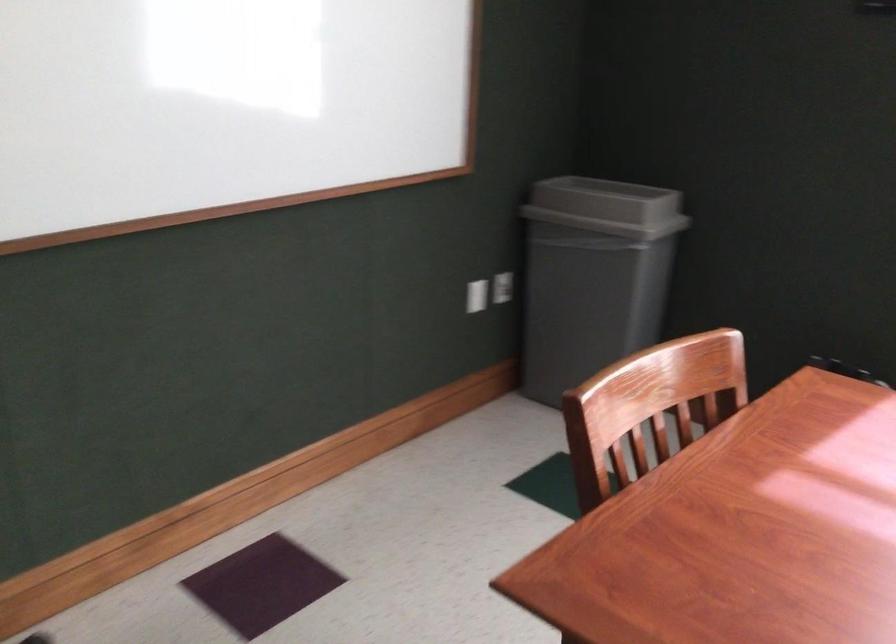
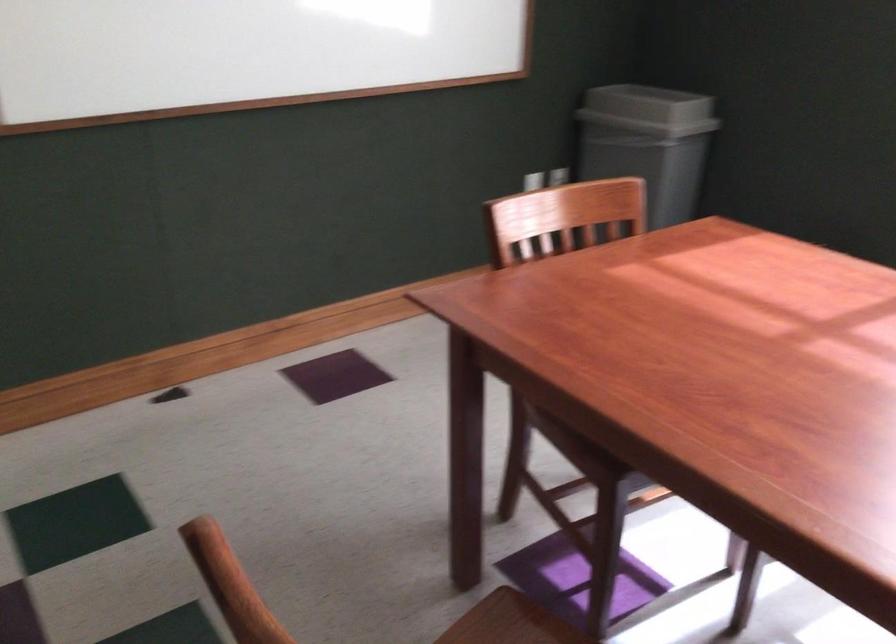
Question: I am providing you with two images of the same scene from different viewpoints. Which of the following objects are not visible in image2?

Choices:
 (A) gray trash can lid
 (B) white light switch
 (C) chair sitting surface
 (D) white tube bottle

Answer: (B)